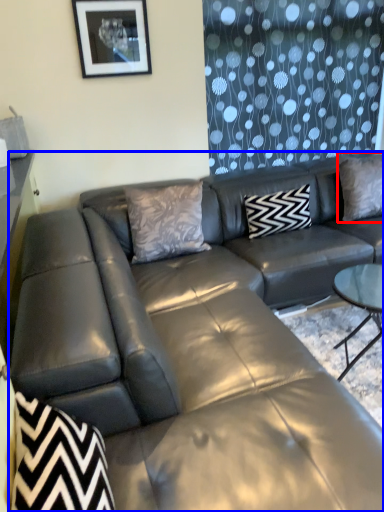
Question: Which point is further to the camera, pillow (highlighted by a red box) or studio couch (highlighted by a blue box)?

Choices:
 (A) pillow
 (B) studio couch

Answer: (A)